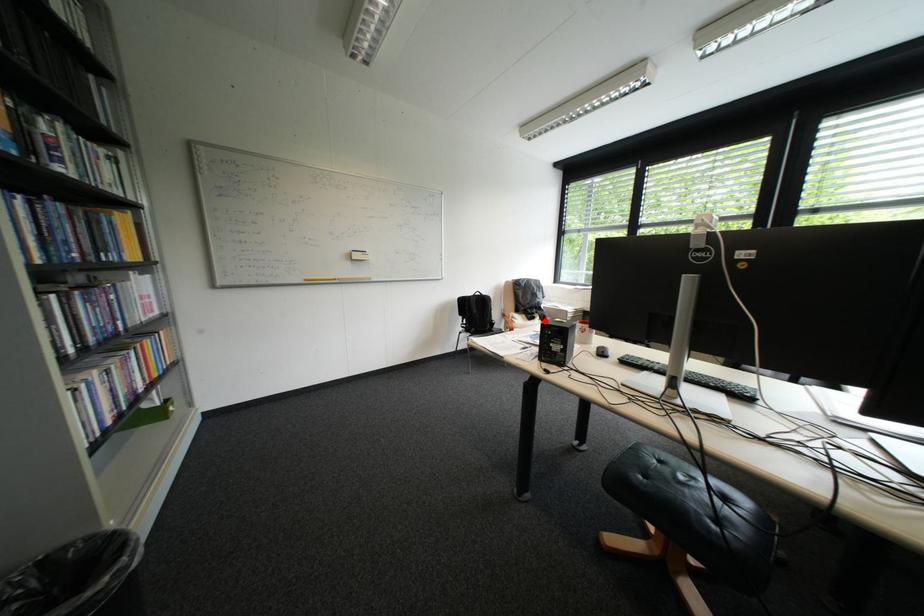
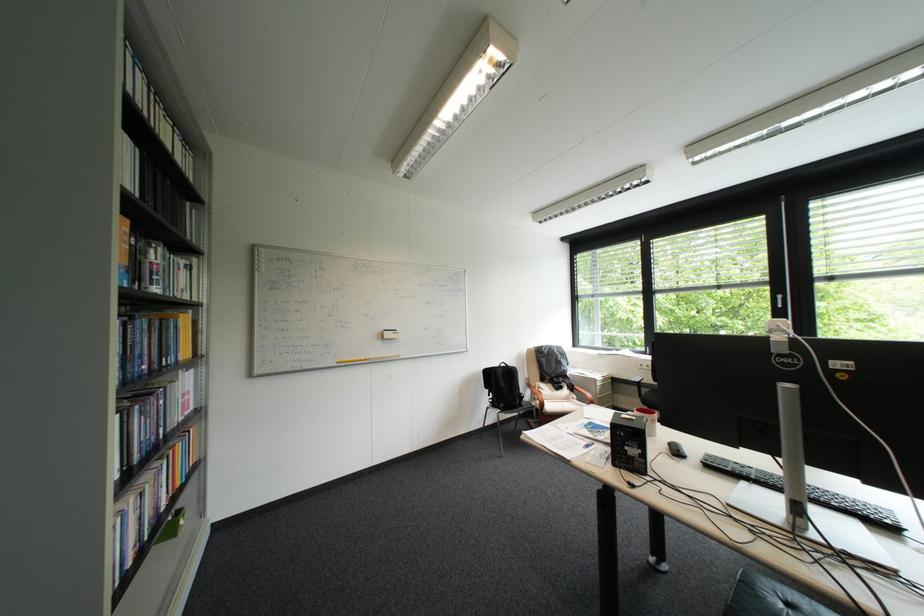
Question: I am providing you with two images of the same scene from different viewpoints. Image1 has a red point marked. In image2, the corresponding 3D location appears at what relative position? Reply with the corresponding letter.

Choices:
 (A) Closer
 (B) Farther

Answer: (B)